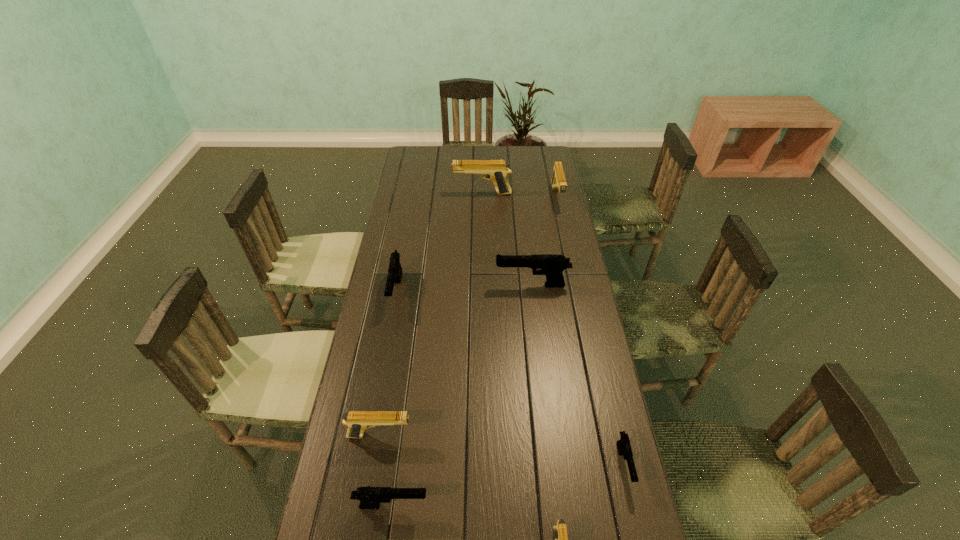
You are a GUI agent. You are given a task and a screenshot of the screen. Output one action in this format:
    pyautogui.click(x=<x>, y=<y>)
    Task: Click on the rightmost object
    
    Given the screenshot: What is the action you would take?
    pyautogui.click(x=624, y=447)

I want to click on free space located at the barrel of the biggest tan pistol, so click(427, 194).

Identify the location of vacant space located 0.140m at the barrel of the biggest tan pistol. (422, 194).

You are a GUI agent. You are given a task and a screenshot of the screen. Output one action in this format:
    pyautogui.click(x=<x>, y=<y>)
    Task: Click on the blank space located 0.050m at the barrel of the biggest tan pistol
    Image resolution: width=960 pixels, height=540 pixels.
    Given the screenshot: What is the action you would take?
    pyautogui.click(x=442, y=194)

Image resolution: width=960 pixels, height=540 pixels. What are the coordinates of `free space located on the front-facing side of the biggest black pistol` in the screenshot? It's located at click(x=438, y=285).

This screenshot has height=540, width=960. I want to click on vacant space located 0.200m on the front-facing side of the biggest black pistol, so click(x=441, y=285).

Locate an element on the screen. free spot located 0.150m on the front-facing side of the biggest black pistol is located at coordinates (454, 285).

This screenshot has height=540, width=960. I want to click on free region located 0.320m at the barrel of the rightmost tan pistol, so click(570, 262).

Where is `vacant space located on the front-facing side of the third smallest black pistol`? The image size is (960, 540). vacant space located on the front-facing side of the third smallest black pistol is located at coordinates (386, 346).

Image resolution: width=960 pixels, height=540 pixels. I want to click on vacant space located at the barrel of the fifth farthest object, so click(496, 435).